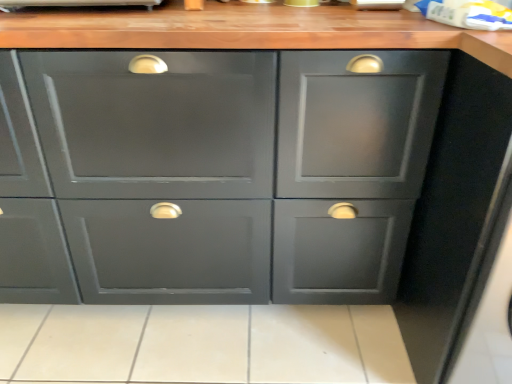
Question: Would you say matte gray cabinet at center is to the left or to the right of beige tile at lower center in the picture?

Choices:
 (A) right
 (B) left

Answer: (B)

Question: Is matte gray cabinet at center wider or thinner than beige tile at lower center?

Choices:
 (A) thin
 (B) wide

Answer: (A)

Question: From their relative heights in the image, would you say matte gray cabinet at center is taller or shorter than beige tile at lower center?

Choices:
 (A) tall
 (B) short

Answer: (A)

Question: Is beige tile at lower center situated inside matte gray cabinet at center or outside?

Choices:
 (A) inside
 (B) outside

Answer: (B)

Question: From their relative heights in the image, would you say beige tile at lower center is taller or shorter than matte gray cabinet at center?

Choices:
 (A) short
 (B) tall

Answer: (A)

Question: Is beige tile at lower center wider or thinner than matte gray cabinet at center?

Choices:
 (A) thin
 (B) wide

Answer: (B)

Question: Does point (22, 337) appear closer or farther from the camera than point (225, 284)?

Choices:
 (A) farther
 (B) closer

Answer: (B)